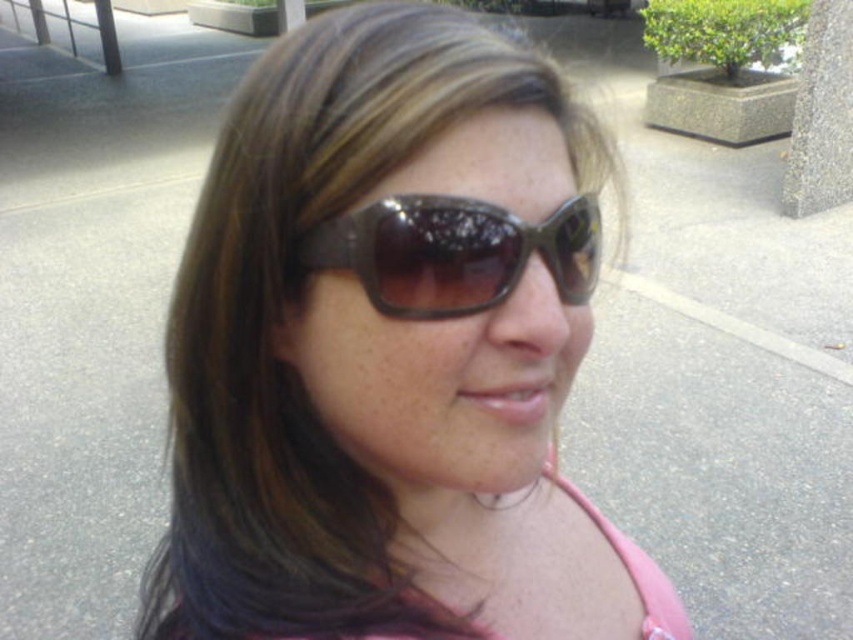
Is point (155, 561) farther from viewer compared to point (352, 227)?

Yes, it is behind point (352, 227).

Does matte brown sunglasses at center appear under shiny brown sunglasses at center?

Yes, matte brown sunglasses at center is below shiny brown sunglasses at center.

Does point (219, 410) lie behind point (439, 273)?

Yes, point (219, 410) is farther from viewer.

You are a GUI agent. You are given a task and a screenshot of the screen. Output one action in this format:
    pyautogui.click(x=<x>, y=<y>)
    Task: Click on the matte brown sunglasses at center
    
    Given the screenshot: What is the action you would take?
    pyautogui.click(x=392, y=352)